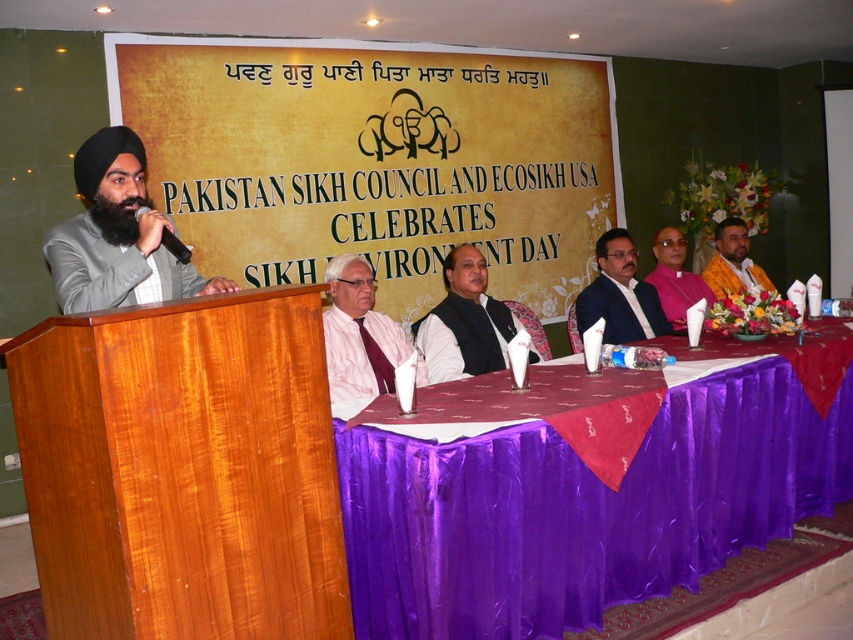
What do you see at coordinates (117, 236) in the screenshot? I see `matte gray suit at left` at bounding box center [117, 236].

Is matte gray suit at left to the left of golden silk robe at right from the viewer's perspective?

Yes, matte gray suit at left is to the left of golden silk robe at right.

The width and height of the screenshot is (853, 640). Find the location of `matte gray suit at left`. matte gray suit at left is located at coordinates (117, 236).

Where is `matte gray suit at left`? The width and height of the screenshot is (853, 640). matte gray suit at left is located at coordinates (117, 236).

Is gold matte signboard at upper center smaller than dark blue suit at center?

Actually, gold matte signboard at upper center might be larger than dark blue suit at center.

Does gold matte signboard at upper center appear under dark blue suit at center?

No, gold matte signboard at upper center is not below dark blue suit at center.

Identify the location of gold matte signboard at upper center. (376, 160).

Is purple satin tablecloth at lower center taller than pink fabric at center?

Yes, purple satin tablecloth at lower center is taller than pink fabric at center.

The height and width of the screenshot is (640, 853). What do you see at coordinates (589, 502) in the screenshot?
I see `purple satin tablecloth at lower center` at bounding box center [589, 502].

The height and width of the screenshot is (640, 853). Find the location of `purple satin tablecloth at lower center`. purple satin tablecloth at lower center is located at coordinates (589, 502).